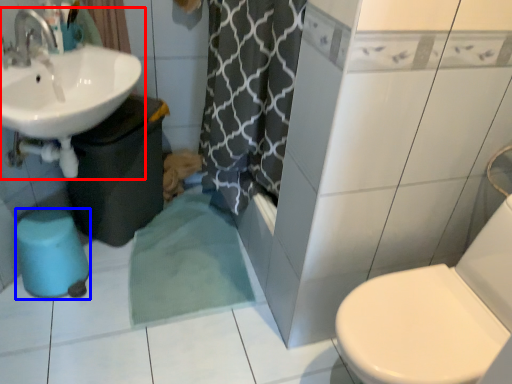
Question: Among these objects, which one is nearest to the camera, sink (highlighted by a red box) or bidet (highlighted by a blue box)?

Choices:
 (A) sink
 (B) bidet

Answer: (A)